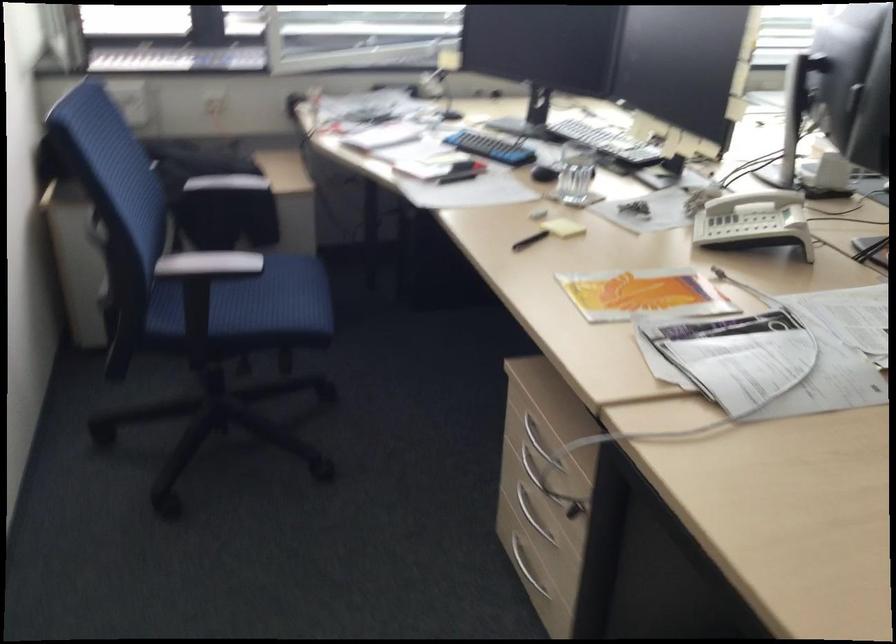
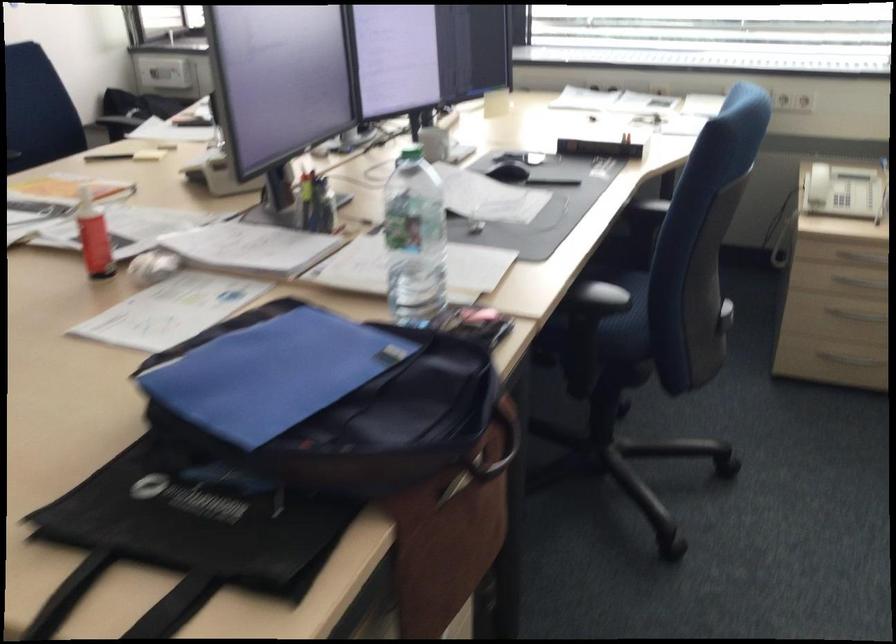
Locate, in the second image, the point that corresponds to the point at 540,243 in the first image.

(108, 156)